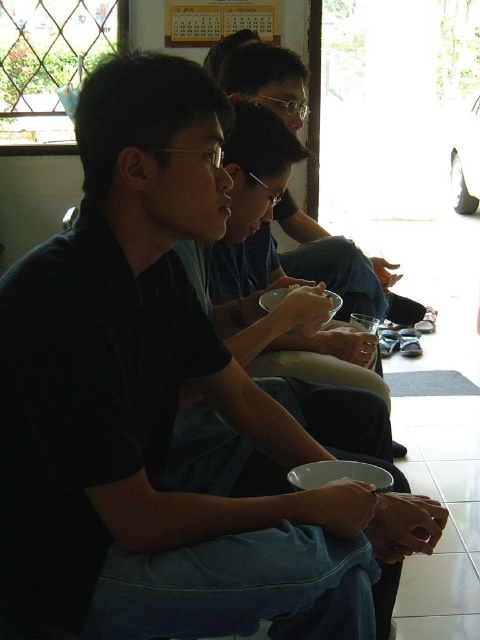
You are a photographer trying to capture a candid shot of the group. You want to ensure that both the matte black shirt at center and the matte black bowl at center are clearly visible in the frame. Based on their positions, which object should you position closer to the left side of your camera viewfinder to include both effectively?

Since the matte black shirt at center is to the right of the matte black bowl at center, you should position the matte black bowl at center closer to the left side of your camera viewfinder. This way, the matte black shirt at center will naturally fall to the right, ensuring both are within the frame without overlapping.

You are a photographer trying to capture a candid shot of the group. You notice the matte black shirt at center and the matte black bowl at center. Which object is covering the other?

The matte black shirt at center is positioned over the matte black bowl at center, so the shirt is covering the bowl.

Consider the image. You are a delivery robot with a 10 inch wide package. You need to place it between the matte black shirt at center and the matte black bowl at center. Is there enough space?

The distance between the matte black shirt at center and the matte black bowl at center is 7.49 inches. Since the package is 10 inches wide, it won,t fit in the space between them.